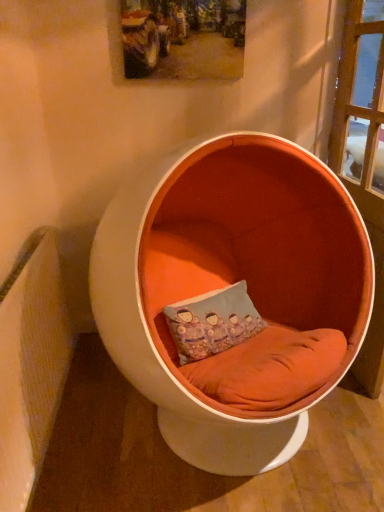
Question: Is wooden textured picture frame at upper center shorter than blue fabric pillow at center?

Choices:
 (A) no
 (B) yes

Answer: (B)

Question: Does wooden textured picture frame at upper center have a greater height compared to blue fabric pillow at center?

Choices:
 (A) yes
 (B) no

Answer: (B)

Question: Considering the relative positions of wooden textured picture frame at upper center and blue fabric pillow at center in the image provided, is wooden textured picture frame at upper center to the right of blue fabric pillow at center from the viewer's perspective?

Choices:
 (A) yes
 (B) no

Answer: (B)

Question: Would you consider wooden textured picture frame at upper center to be distant from blue fabric pillow at center?

Choices:
 (A) no
 (B) yes

Answer: (B)

Question: From a real-world perspective, is wooden textured picture frame at upper center physically below blue fabric pillow at center?

Choices:
 (A) yes
 (B) no

Answer: (B)

Question: In terms of width, does blue fabric pillow at center look wider or thinner when compared to orange fabric chair at center?

Choices:
 (A) wide
 (B) thin

Answer: (B)

Question: Considering their positions, is blue fabric pillow at center located in front of or behind orange fabric chair at center?

Choices:
 (A) front
 (B) behind

Answer: (B)

Question: From a real-world perspective, is blue fabric pillow at center above or below orange fabric chair at center?

Choices:
 (A) above
 (B) below

Answer: (B)

Question: Considering the positions of blue fabric pillow at center and orange fabric chair at center in the image, is blue fabric pillow at center taller or shorter than orange fabric chair at center?

Choices:
 (A) short
 (B) tall

Answer: (A)

Question: In the image, is wooden textured picture frame at upper center positioned in front of or behind blue fabric pillow at center?

Choices:
 (A) front
 (B) behind

Answer: (B)

Question: Choose the correct answer: Is wooden textured picture frame at upper center inside blue fabric pillow at center or outside it?

Choices:
 (A) outside
 (B) inside

Answer: (A)

Question: In the image, is wooden textured picture frame at upper center on the left side or the right side of blue fabric pillow at center?

Choices:
 (A) left
 (B) right

Answer: (A)

Question: From their relative heights in the image, would you say wooden textured picture frame at upper center is taller or shorter than blue fabric pillow at center?

Choices:
 (A) tall
 (B) short

Answer: (B)

Question: Is point (274, 419) closer or farther from the camera than point (132, 57)?

Choices:
 (A) farther
 (B) closer

Answer: (B)

Question: Is orange fabric chair at center situated inside wooden textured picture frame at upper center or outside?

Choices:
 (A) inside
 (B) outside

Answer: (B)